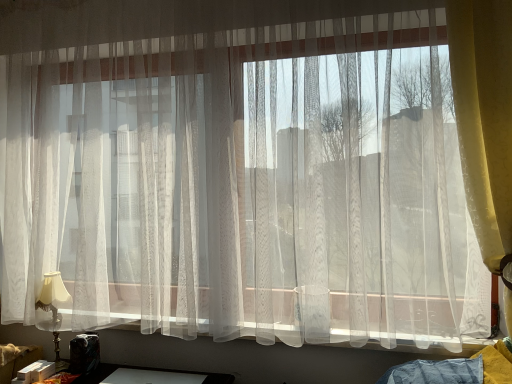
Question: Choose the correct answer: Is matte gold table lamp at left inside yellow textured curtain at right or outside it?

Choices:
 (A) inside
 (B) outside

Answer: (B)

Question: Looking at their shapes, would you say matte gold table lamp at left is wider or thinner than yellow textured curtain at right?

Choices:
 (A) thin
 (B) wide

Answer: (A)

Question: From the image's perspective, is matte gold table lamp at left located above or below yellow textured curtain at right?

Choices:
 (A) above
 (B) below

Answer: (B)

Question: Choose the correct answer: Is yellow textured curtain at right inside matte gold table lamp at left or outside it?

Choices:
 (A) inside
 (B) outside

Answer: (B)

Question: In the image, is yellow textured curtain at right positioned in front of or behind matte gold table lamp at left?

Choices:
 (A) front
 (B) behind

Answer: (A)

Question: Is yellow textured curtain at right bigger or smaller than matte gold table lamp at left?

Choices:
 (A) small
 (B) big

Answer: (B)

Question: Considering the positions of yellow textured curtain at right and matte gold table lamp at left in the image, is yellow textured curtain at right wider or thinner than matte gold table lamp at left?

Choices:
 (A) thin
 (B) wide

Answer: (B)